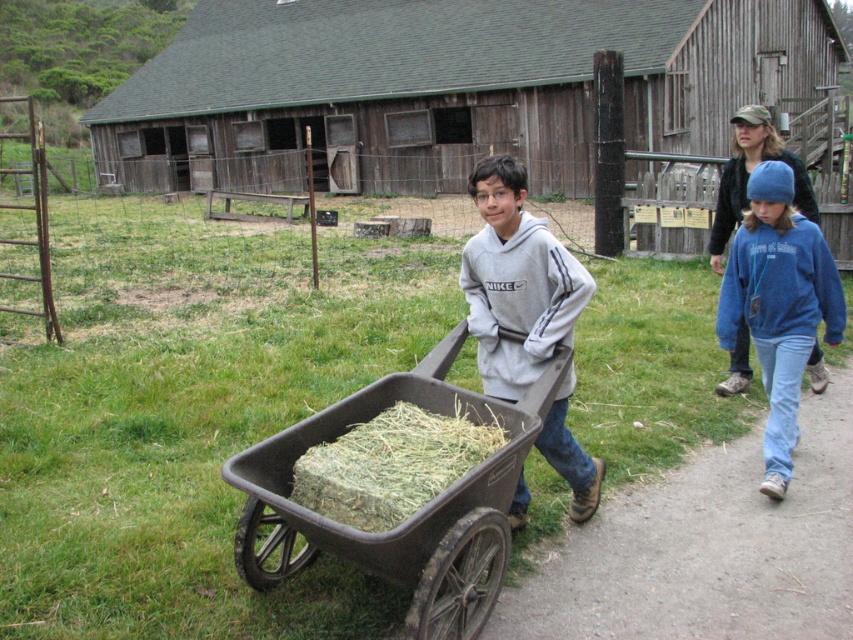
Does green grass at center have a larger size compared to gray fleece hoodie at center?

Yes.

Which of these two, green grass at center or gray fleece hoodie at center, stands taller?

With more height is green grass at center.

This screenshot has height=640, width=853. I want to click on green grass at center, so click(x=190, y=416).

Which is in front, point (430, 280) or point (604, 525)?

Point (604, 525) is more forward.

Between green grass at center and dirt path at lower right, which one appears on the right side from the viewer's perspective?

dirt path at lower right is more to the right.

What do you see at coordinates (190, 416) in the screenshot? I see `green grass at center` at bounding box center [190, 416].

Where is `green grass at center`? green grass at center is located at coordinates (190, 416).

Locate an element on the screen. This screenshot has height=640, width=853. green grass at center is located at coordinates (190, 416).

Is green grass at center bigger than dark gray plastic cart at center?

Yes.

You are a GUI agent. You are given a task and a screenshot of the screen. Output one action in this format:
    pyautogui.click(x=<x>, y=<y>)
    Task: Click on the green grass at center
    This screenshot has height=640, width=853.
    Given the screenshot: What is the action you would take?
    pyautogui.click(x=190, y=416)